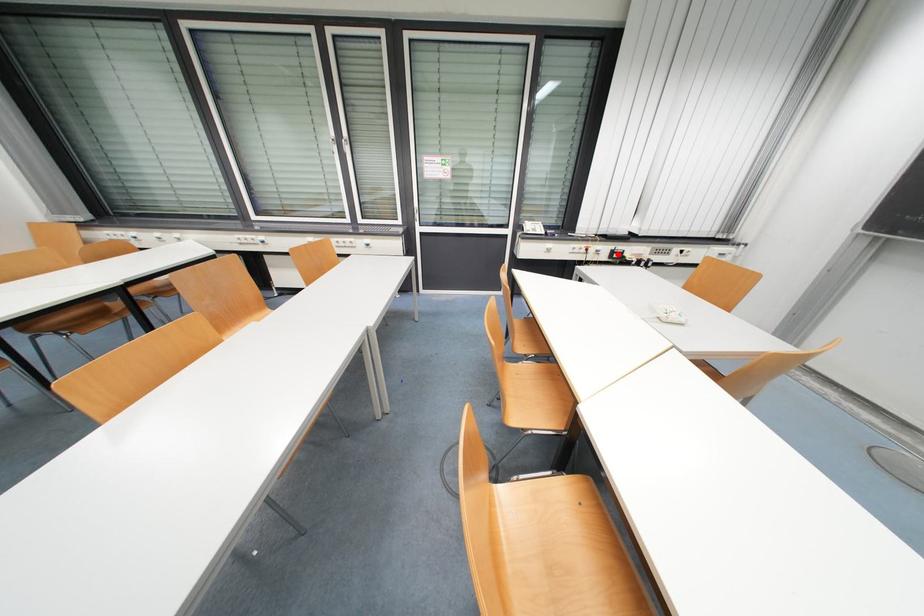
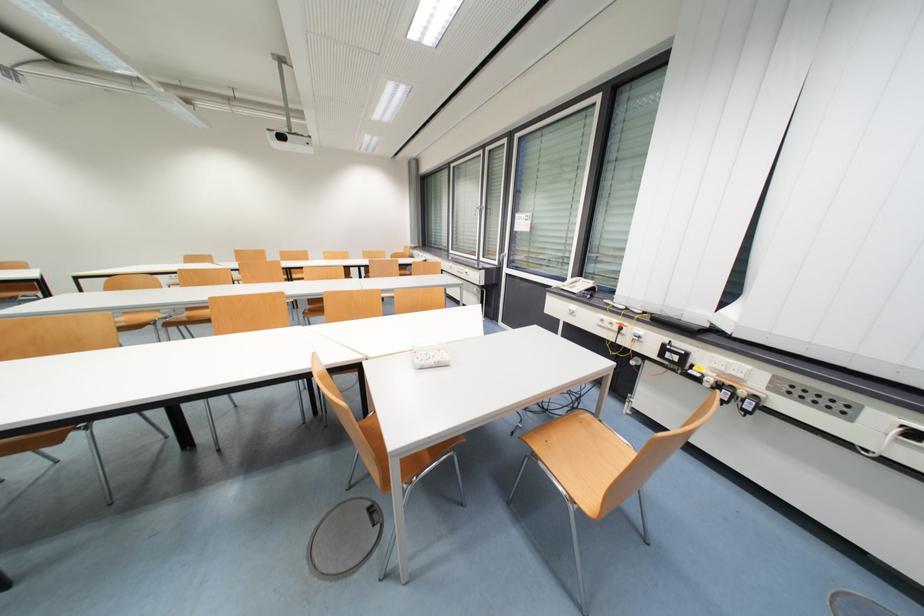
In the second image, find the point that corresponds to the highlighted location in the first image.

(671, 350)